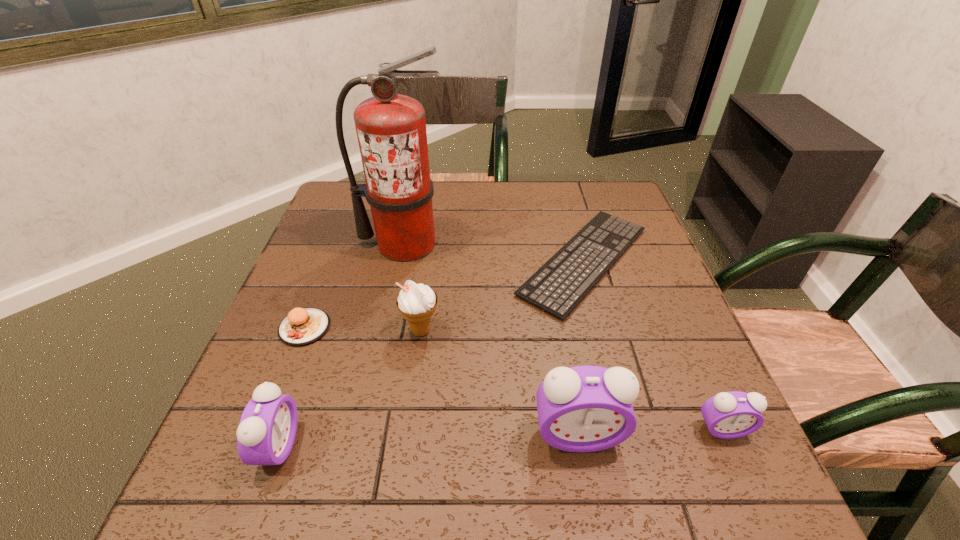
What are the coordinates of `free space for an extra alarm_clock to achieve even spacing` in the screenshot? It's located at (430, 440).